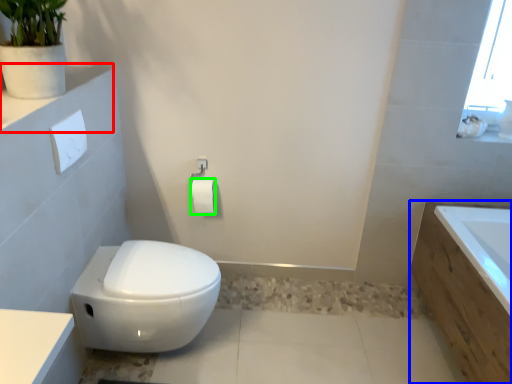
Question: Which is nearer to the ledge (highlighted by a red box)? bath (highlighted by a blue box) or toilet paper (highlighted by a green box).

Choices:
 (A) bath
 (B) toilet paper

Answer: (B)